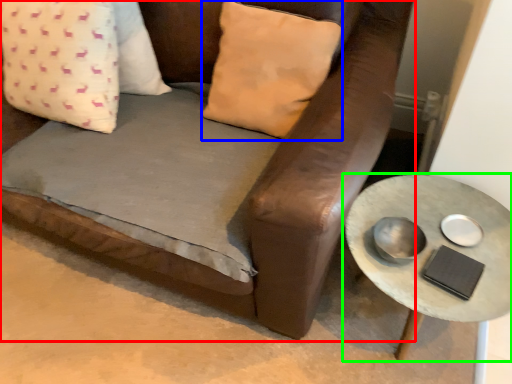
Question: Considering the real-world distances, which object is closest to studio couch (highlighted by a red box)? pillow (highlighted by a blue box) or table (highlighted by a green box).

Choices:
 (A) pillow
 (B) table

Answer: (A)